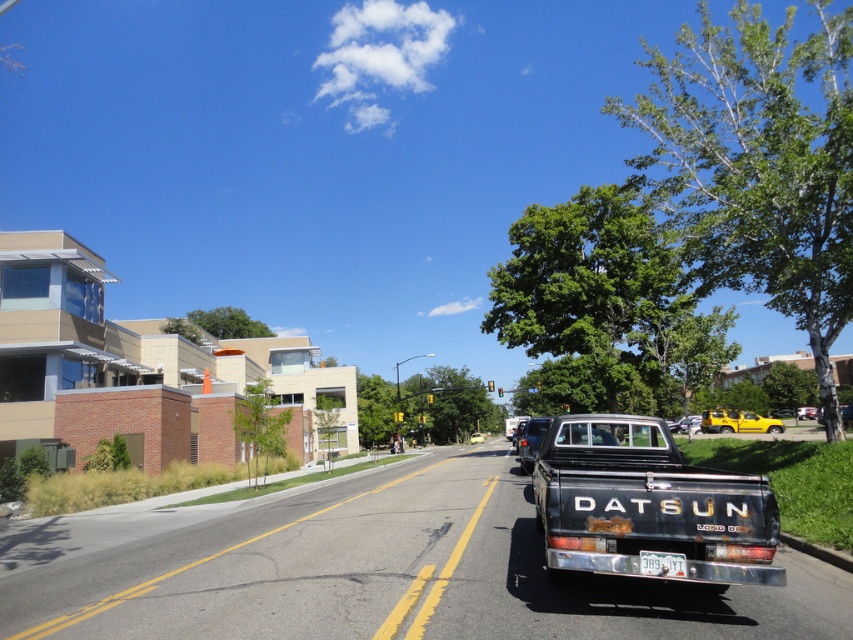
Question: Which point is closer to the camera?

Choices:
 (A) white plastic license plate at center
 (B) yellow matte pickup truck at center
 (C) metallic silver car at center
 (D) matte black truck at center

Answer: (A)

Question: Is metallic silver car at center positioned at the back of white plastic license plate at center?

Choices:
 (A) no
 (B) yes

Answer: (B)

Question: Does rusty black truck at center appear over metallic silver car at center?

Choices:
 (A) no
 (B) yes

Answer: (B)

Question: Can you confirm if metallic silver car at center is wider than metallic silver truck at center?

Choices:
 (A) yes
 (B) no

Answer: (A)

Question: Which object is closer to the camera taking this photo?

Choices:
 (A) rusty black truck at center
 (B) metallic silver car at center
 (C) yellow matte pickup truck at center

Answer: (A)

Question: Considering the real-world distances, which object is farthest from the metallic silver truck at center?

Choices:
 (A) yellow matte pickup truck at center
 (B) metallic silver car at center
 (C) white plastic license plate at center

Answer: (C)